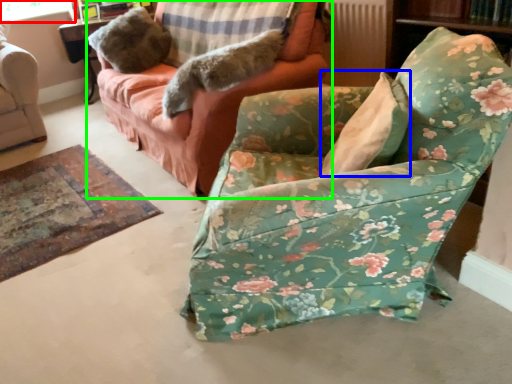
Question: Considering the real-world distances, which object is farthest from window screen (highlighted by a red box)? pillow (highlighted by a blue box) or studio couch (highlighted by a green box)?

Choices:
 (A) pillow
 (B) studio couch

Answer: (A)